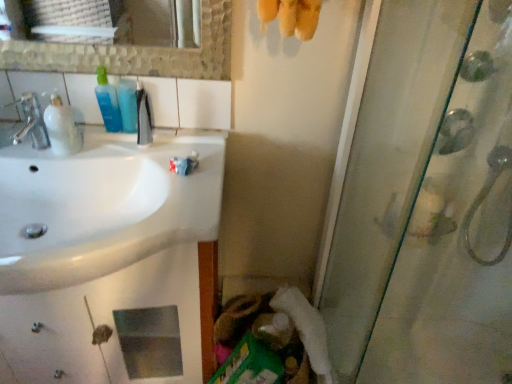
Question: Can you confirm if white fluffy toilet paper at lower center is positioned to the left of white glossy sink at left?

Choices:
 (A) no
 (B) yes

Answer: (A)

Question: Does white fluffy toilet paper at lower center turn towards white glossy sink at left?

Choices:
 (A) no
 (B) yes

Answer: (A)

Question: Can you confirm if white fluffy toilet paper at lower center is smaller than white glossy sink at left?

Choices:
 (A) no
 (B) yes

Answer: (B)

Question: Does white fluffy toilet paper at lower center have a lesser width compared to white glossy sink at left?

Choices:
 (A) yes
 (B) no

Answer: (A)

Question: Is white fluffy toilet paper at lower center closer to camera compared to white glossy sink at left?

Choices:
 (A) no
 (B) yes

Answer: (A)

Question: Can you confirm if white fluffy toilet paper at lower center is bigger than white glossy sink at left?

Choices:
 (A) no
 (B) yes

Answer: (A)

Question: Is matte silver faucet at left smaller than blue translucent bottle at upper left, which is the 2th mouthwash from right to left?

Choices:
 (A) yes
 (B) no

Answer: (B)

Question: Can you confirm if matte silver faucet at left is thinner than blue translucent bottle at upper left, which is the 3th mouthwash from left to right?

Choices:
 (A) yes
 (B) no

Answer: (B)

Question: Is matte silver faucet at left shorter than blue translucent bottle at upper left, which is the 3th mouthwash from left to right?

Choices:
 (A) no
 (B) yes

Answer: (A)

Question: Is there a large distance between matte silver faucet at left and blue translucent bottle at upper left, which is the 3th mouthwash from left to right?

Choices:
 (A) yes
 (B) no

Answer: (B)

Question: From a real-world perspective, is matte silver faucet at left on top of blue translucent bottle at upper left, which is the 3th mouthwash from left to right?

Choices:
 (A) no
 (B) yes

Answer: (A)

Question: Does matte silver faucet at left come in front of blue translucent bottle at upper left, which is the 3th mouthwash from left to right?

Choices:
 (A) no
 (B) yes

Answer: (B)

Question: Is translucent plastic mouthwash at left, which is counted as the 1th mouthwash, starting from the left, inside white fluffy toilet paper at lower center?

Choices:
 (A) no
 (B) yes

Answer: (A)